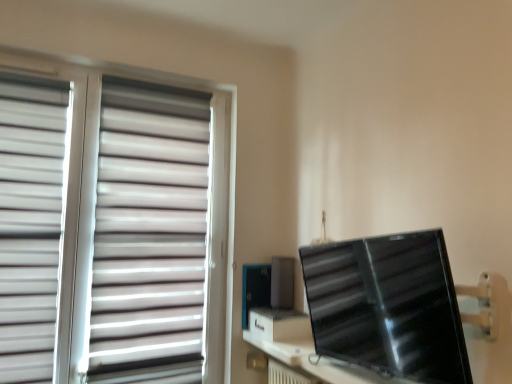
Question: From a real-world perspective, is black glossy monitor at right over white matte blinds at left?

Choices:
 (A) no
 (B) yes

Answer: (A)

Question: Is black glossy monitor at right not near white matte blinds at left?

Choices:
 (A) yes
 (B) no

Answer: (A)

Question: Would you say black glossy monitor at right is outside white matte blinds at left?

Choices:
 (A) no
 (B) yes

Answer: (B)

Question: Is white matte blinds at left a part of black glossy monitor at right?

Choices:
 (A) yes
 (B) no

Answer: (B)

Question: Is black glossy monitor at right aimed at white matte blinds at left?

Choices:
 (A) no
 (B) yes

Answer: (A)

Question: Can you confirm if black glossy monitor at right is smaller than white matte blinds at left?

Choices:
 (A) yes
 (B) no

Answer: (A)

Question: From a real-world perspective, is white matte blinds at left, the second curtain viewed from the right, positioned over white matte blinds at left based on gravity?

Choices:
 (A) no
 (B) yes

Answer: (B)

Question: Considering the relative sizes of white matte blinds at left, the second curtain viewed from the right, and white matte blinds at left in the image provided, is white matte blinds at left, the second curtain viewed from the right, shorter than white matte blinds at left?

Choices:
 (A) no
 (B) yes

Answer: (B)

Question: Is white matte blinds at left, the second curtain viewed from the right, positioned beyond the bounds of white matte blinds at left?

Choices:
 (A) no
 (B) yes

Answer: (A)

Question: Is white matte blinds at left, the first curtain viewed from the left, behind white matte blinds at left?

Choices:
 (A) yes
 (B) no

Answer: (B)

Question: From a real-world perspective, is white matte blinds at left, the second curtain viewed from the right, under white matte blinds at left?

Choices:
 (A) yes
 (B) no

Answer: (B)

Question: Is white matte blinds at left, the first curtain viewed from the left, far away from white matte blinds at left?

Choices:
 (A) no
 (B) yes

Answer: (A)

Question: From the image's perspective, is white matte blinds at left located above black glossy monitor at right?

Choices:
 (A) yes
 (B) no

Answer: (A)